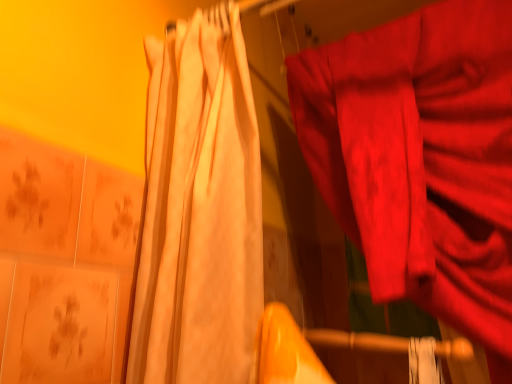
Question: Looking at the image, does matte white curtain at left, the 2th curtain when ordered from right to left, seem bigger or smaller compared to matte red fabric at right, arranged as the second curtain when viewed from the left?

Choices:
 (A) big
 (B) small

Answer: (B)

Question: From their relative heights in the image, would you say matte white curtain at left, which is the 1th curtain from left to right, is taller or shorter than matte red fabric at right, arranged as the second curtain when viewed from the left?

Choices:
 (A) short
 (B) tall

Answer: (A)

Question: Choose the correct answer: Is matte white curtain at left, which is the 1th curtain from left to right, inside matte red fabric at right, positioned as the 1th curtain in right-to-left order, or outside it?

Choices:
 (A) outside
 (B) inside

Answer: (A)

Question: Relative to matte white curtain at left, the 2th curtain when ordered from right to left, is matte red fabric at right, arranged as the second curtain when viewed from the left, in front or behind?

Choices:
 (A) behind
 (B) front

Answer: (A)

Question: From the image's perspective, is matte red fabric at right, arranged as the second curtain when viewed from the left, above or below matte white curtain at left, which is the 1th curtain from left to right?

Choices:
 (A) above
 (B) below

Answer: (B)

Question: Is matte red fabric at right, positioned as the 1th curtain in right-to-left order, spatially inside matte white curtain at left, which is the 1th curtain from left to right, or outside of it?

Choices:
 (A) outside
 (B) inside

Answer: (A)

Question: Would you say matte red fabric at right, arranged as the second curtain when viewed from the left, is to the left or to the right of matte white curtain at left, which is the 1th curtain from left to right, in the picture?

Choices:
 (A) right
 (B) left

Answer: (A)